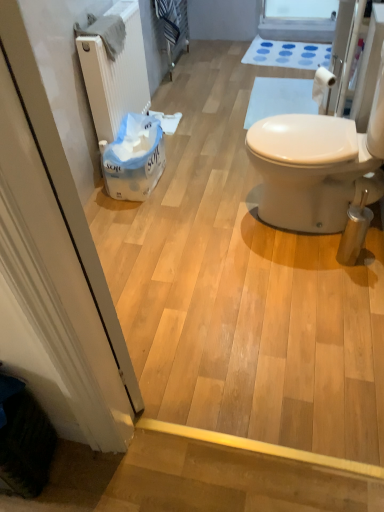
Identify the location of free space behind white matte screen door at left. This screenshot has width=384, height=512. (140, 320).